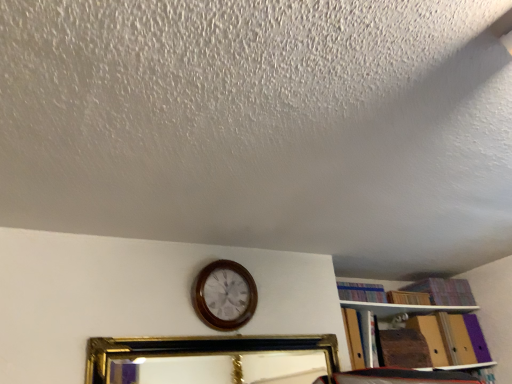
Where is `wooden wall clock at center`? wooden wall clock at center is located at coordinates 224,295.

This screenshot has width=512, height=384. What are the coordinates of `striped fabric book at upper right` in the screenshot? It's located at (361, 292).

Does striped fabric book at upper right have a lesser height compared to wooden wall clock at center?

Indeed, striped fabric book at upper right has a lesser height compared to wooden wall clock at center.

Is striped fabric book at upper right not close to wooden wall clock at center?

striped fabric book at upper right is actually quite close to wooden wall clock at center.

Which is less distant, (383,293) or (230,282)?

Point (383,293) is farther from the camera than point (230,282).

Is striped fabric book at upper right positioned behind wooden wall clock at center?

Yes, striped fabric book at upper right is behind wooden wall clock at center.

Is wooden wall clock at center bigger than striped fabric book at upper right?

Correct, wooden wall clock at center is larger in size than striped fabric book at upper right.

Based on their positions, is wooden wall clock at center located to the left or right of striped fabric book at upper right?

In the image, wooden wall clock at center appears on the left side of striped fabric book at upper right.

Considering their positions, is wooden wall clock at center located in front of or behind striped fabric book at upper right?

wooden wall clock at center is positioned closer to the viewer than striped fabric book at upper right.

Which is correct: wooden wall clock at center is inside striped fabric book at upper right, or outside of it?

wooden wall clock at center is outside striped fabric book at upper right.

From the image's perspective, between wooden wall clock at center and gold/gilded picture frame at center, which one is located above?

wooden wall clock at center.

Measure the distance from wooden wall clock at center to gold/gilded picture frame at center.

A distance of 1.87 meters exists between wooden wall clock at center and gold/gilded picture frame at center.

Does wooden wall clock at center turn towards gold/gilded picture frame at center?

No, wooden wall clock at center is not aimed at gold/gilded picture frame at center.

Consider the image. Does wooden wall clock at center appear on the left side of gold/gilded picture frame at center?

Correct, you'll find wooden wall clock at center to the left of gold/gilded picture frame at center.

From the image's perspective, is striped fabric book at upper right positioned above or below gold/gilded picture frame at center?

striped fabric book at upper right is situated higher than gold/gilded picture frame at center in the image.

From a real-world perspective, is striped fabric book at upper right located beneath gold/gilded picture frame at center?

No, from a real-world perspective, striped fabric book at upper right is not under gold/gilded picture frame at center.

Is striped fabric book at upper right looking in the opposite direction of gold/gilded picture frame at center?

That's not correct — striped fabric book at upper right is not looking away from gold/gilded picture frame at center.

How far apart are striped fabric book at upper right and gold/gilded picture frame at center?

A distance of 6.30 feet exists between striped fabric book at upper right and gold/gilded picture frame at center.

Can you confirm if gold/gilded picture frame at center is positioned to the left of striped fabric book at upper right?

Yes.

How distant is gold/gilded picture frame at center from striped fabric book at upper right?

The distance of gold/gilded picture frame at center from striped fabric book at upper right is 1.92 meters.

How many degrees apart are the facing directions of gold/gilded picture frame at center and striped fabric book at upper right?

The angular difference between gold/gilded picture frame at center and striped fabric book at upper right is 4.25 degrees.

Is gold/gilded picture frame at center with striped fabric book at upper right?

No, gold/gilded picture frame at center is not touching striped fabric book at upper right.

Is point (161, 345) closer or farther from the camera than point (224, 267)?

Point (161, 345) is positioned closer to the camera compared to point (224, 267).

Is gold/gilded picture frame at center aimed at wooden wall clock at center?

No, gold/gilded picture frame at center is not oriented towards wooden wall clock at center.

Is gold/gilded picture frame at center positioned behind wooden wall clock at center?

That is False.

You are a GUI agent. You are given a task and a screenshot of the screen. Output one action in this format:
    pyautogui.click(x=<x>, y=<y>)
    Task: Click on the wall clock below the striped fabric book at upper right (from a real-world perspective)
    
    Given the screenshot: What is the action you would take?
    pyautogui.click(x=224, y=295)

The height and width of the screenshot is (384, 512). Find the location of `book on the right of the wooden wall clock at center`. book on the right of the wooden wall clock at center is located at coordinates (361, 292).

Considering their positions, is wooden wall clock at center positioned further to gold/gilded picture frame at center than striped fabric book at upper right?

striped fabric book at upper right is positioned further to the anchor gold/gilded picture frame at center.

Estimate the real-world distances between objects in this image. Which object is further from striped fabric book at upper right, wooden wall clock at center or gold/gilded picture frame at center?

gold/gilded picture frame at center is further to striped fabric book at upper right.

From the image, which object appears to be farther from striped fabric book at upper right, gold/gilded picture frame at center or wooden wall clock at center?

gold/gilded picture frame at center is positioned further to the anchor striped fabric book at upper right.

Estimate the real-world distances between objects in this image. Which object is further from gold/gilded picture frame at center, striped fabric book at upper right or wooden wall clock at center?

striped fabric book at upper right lies further to gold/gilded picture frame at center than the other object.

When comparing their distances from wooden wall clock at center, does gold/gilded picture frame at center or striped fabric book at upper right seem closer?

striped fabric book at upper right is positioned closer to the anchor wooden wall clock at center.

Based on their spatial positions, is striped fabric book at upper right or gold/gilded picture frame at center closer to wooden wall clock at center?

The object closer to wooden wall clock at center is striped fabric book at upper right.

I want to click on wall clock located between gold/gilded picture frame at center and striped fabric book at upper right in the depth direction, so click(224, 295).